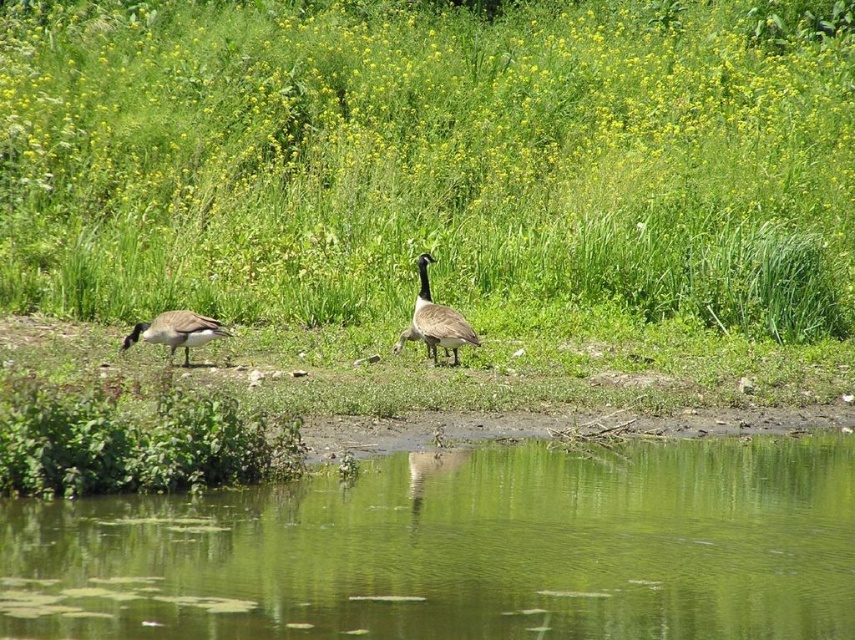
Question: Based on their relative distances, which object is nearer to the green reflective water at center?

Choices:
 (A) brown feathered duck at left
 (B) green grass at center

Answer: (A)

Question: Can you confirm if green reflective water at center is thinner than brown feathered duck at left?

Choices:
 (A) yes
 (B) no

Answer: (B)

Question: Which point is farther to the camera?

Choices:
 (A) (305, 515)
 (B) (502, 221)
 (C) (180, 340)

Answer: (B)

Question: Is green grass at center to the left of brown feathered goose at center from the viewer's perspective?

Choices:
 (A) no
 (B) yes

Answer: (A)

Question: Which point is farther to the camera?

Choices:
 (A) (240, 17)
 (B) (169, 316)

Answer: (A)

Question: Is green grass at center to the right of brown feathered duck at left from the viewer's perspective?

Choices:
 (A) no
 (B) yes

Answer: (B)